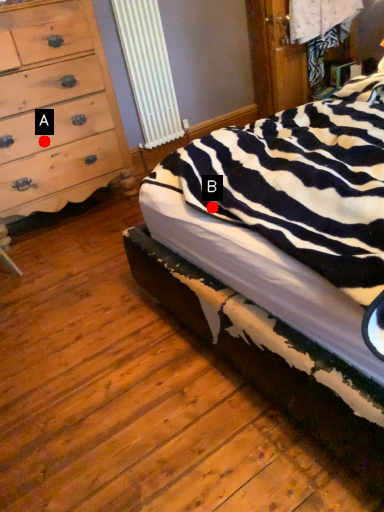
Question: Two points are circled on the image, labeled by A and B beside each circle. Which point appears closest to the camera in this image?

Choices:
 (A) A is closer
 (B) B is closer

Answer: (B)